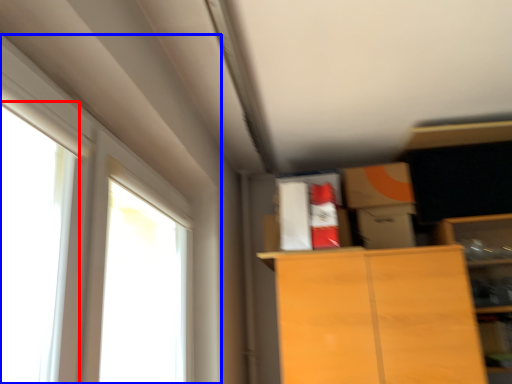
Question: Which object is further to the camera taking this photo, window (highlighted by a red box) or window (highlighted by a blue box)?

Choices:
 (A) window
 (B) window

Answer: (B)